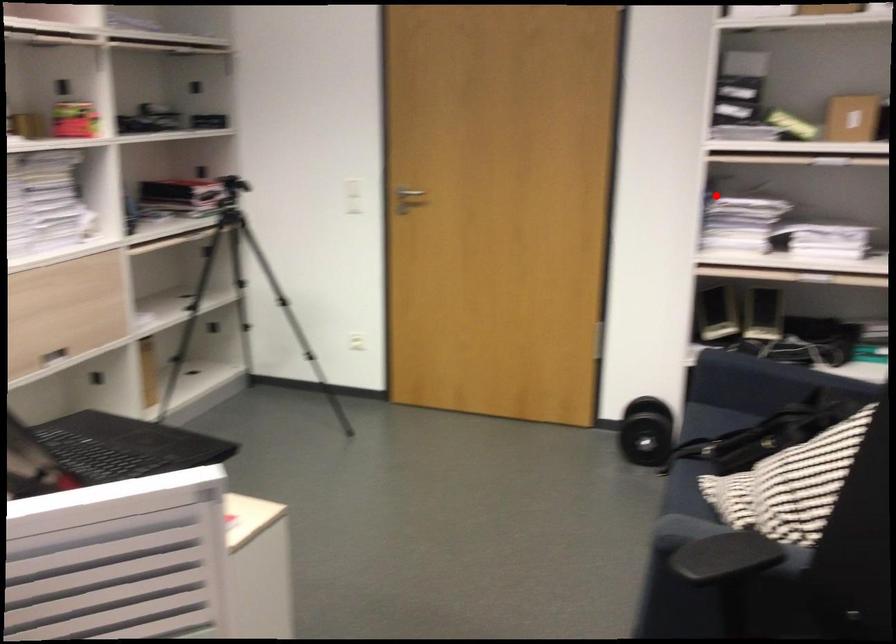
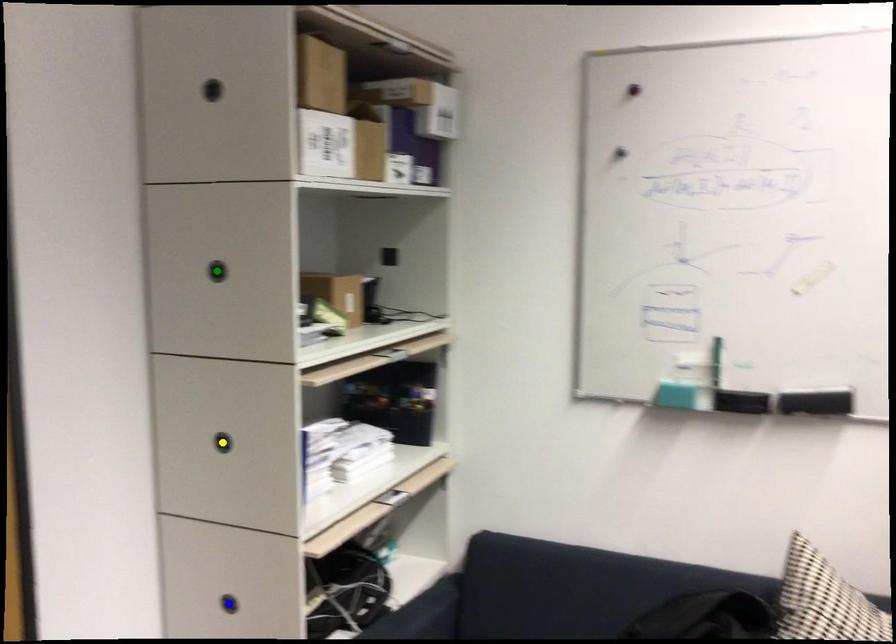
Question: I am providing you with two images of the same scene from different viewpoints. A red point is marked on the first image. You are given multiple points on the second image. In image 2, which mark is for the same physical point as the one in image 1?

Choices:
 (A) blue point
 (B) yellow point
 (C) green point

Answer: (B)